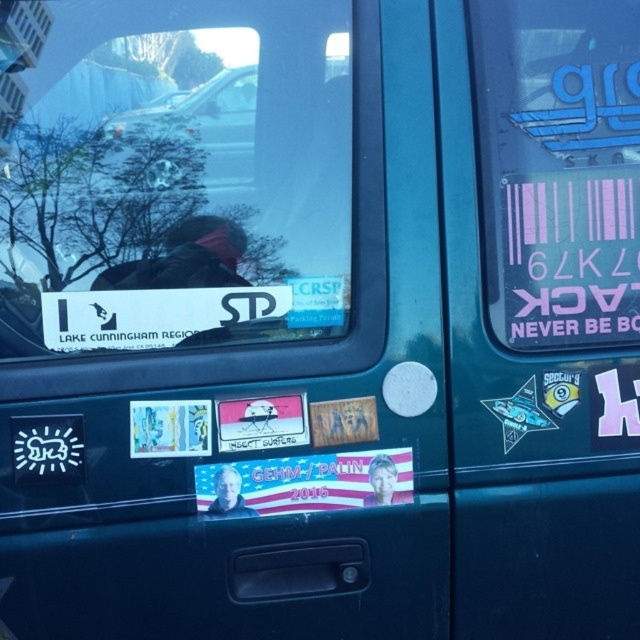
Is pink matte sticker at upper right above metallic silver car at upper center?

No.

Find the location of a particular element. The width and height of the screenshot is (640, 640). pink matte sticker at upper right is located at coordinates (560, 168).

Between transparent glass window at upper center and pink matte sticker at upper right, which one has more height?

transparent glass window at upper center

Is transparent glass window at upper center to the left of pink matte sticker at upper right from the viewer's perspective?

Indeed, transparent glass window at upper center is positioned on the left side of pink matte sticker at upper right.

Identify the location of transparent glass window at upper center. (172, 172).

Which of these two, transparent glass window at upper center or metallic silver car at upper center, stands shorter?

Standing shorter between the two is metallic silver car at upper center.

Does transparent glass window at upper center have a greater width compared to metallic silver car at upper center?

Correct, the width of transparent glass window at upper center exceeds that of metallic silver car at upper center.

The width and height of the screenshot is (640, 640). Describe the element at coordinates (172, 172) in the screenshot. I see `transparent glass window at upper center` at that location.

You are a GUI agent. You are given a task and a screenshot of the screen. Output one action in this format:
    pyautogui.click(x=<x>, y=<y>)
    Task: Click on the transparent glass window at upper center
    This screenshot has width=640, height=640.
    Given the screenshot: What is the action you would take?
    pyautogui.click(x=172, y=172)